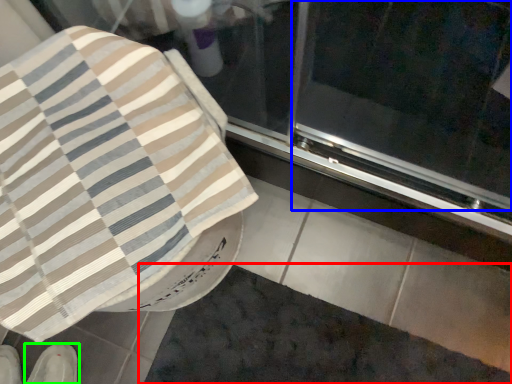
Question: Which is nearer to the bath mat (highlighted by a red box)? screen door (highlighted by a blue box) or footwear (highlighted by a green box).

Choices:
 (A) screen door
 (B) footwear

Answer: (B)